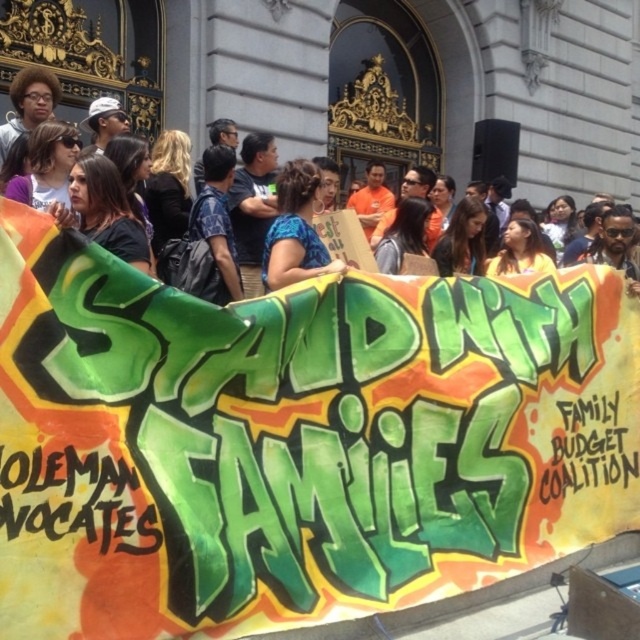
Is green painted banner at center in front of matte black banner at center?

Yes.

The image size is (640, 640). Find the location of `green painted banner at center`. green painted banner at center is located at coordinates (296, 440).

Is blue fabric shirt at center smaller than matte black banner at center?

Correct, blue fabric shirt at center occupies less space than matte black banner at center.

Is the position of blue fabric shirt at center less distant than that of matte black banner at center?

No, blue fabric shirt at center is behind matte black banner at center.

Where is `blue fabric shirt at center`? The width and height of the screenshot is (640, 640). blue fabric shirt at center is located at coordinates (296, 228).

Does green painted banner at center appear on the left side of blue fabric shirt at center?

In fact, green painted banner at center is to the right of blue fabric shirt at center.

What are the coordinates of `green painted banner at center` in the screenshot? It's located at (296, 440).

Locate an element on the screen. The image size is (640, 640). green painted banner at center is located at coordinates (296, 440).